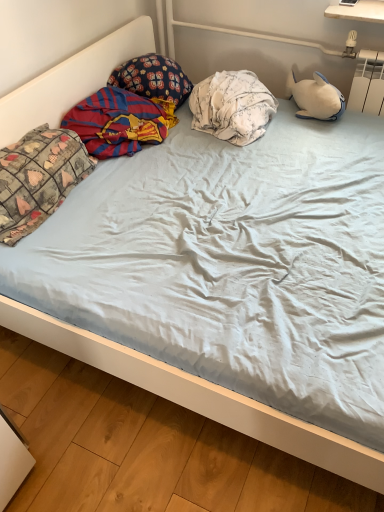
What do you see at coordinates (119, 122) in the screenshot? I see `red and blue striped fabric at left` at bounding box center [119, 122].

Measure the distance between red and blue striped fabric at left and camera.

red and blue striped fabric at left and camera are 1.78 meters apart from each other.

The image size is (384, 512). Describe the element at coordinates (232, 106) in the screenshot. I see `white floral fabric pillow at center, acting as the 3th pillow starting from the left` at that location.

Describe the element at coordinates (38, 178) in the screenshot. I see `patchwork fabric pillow at left, the first pillow from the left` at that location.

Locate an element on the screen. This screenshot has width=384, height=512. red and blue striped fabric at left is located at coordinates (119, 122).

Is white floral fabric pillow at center, placed as the 1th pillow when sorted from right to left, facing away from dark blue floral pillow at upper left, placed as the 2th pillow when sorted from left to right?

Absolutely, white floral fabric pillow at center, placed as the 1th pillow when sorted from right to left, is directed away from dark blue floral pillow at upper left, placed as the 2th pillow when sorted from left to right.

Is white floral fabric pillow at center, placed as the 1th pillow when sorted from right to left, outside of dark blue floral pillow at upper left, which ranks as the 2th pillow in right-to-left order?

white floral fabric pillow at center, placed as the 1th pillow when sorted from right to left, is positioned outside dark blue floral pillow at upper left, which ranks as the 2th pillow in right-to-left order.

Consider the image. Looking at the image, does white floral fabric pillow at center, placed as the 1th pillow when sorted from right to left, seem bigger or smaller compared to dark blue floral pillow at upper left, which ranks as the 2th pillow in right-to-left order?

In the image, white floral fabric pillow at center, placed as the 1th pillow when sorted from right to left, appears to be larger than dark blue floral pillow at upper left, which ranks as the 2th pillow in right-to-left order.

Which of these two, white floral fabric pillow at center, placed as the 1th pillow when sorted from right to left, or dark blue floral pillow at upper left, placed as the 2th pillow when sorted from left to right, stands taller?

Standing taller between the two is dark blue floral pillow at upper left, placed as the 2th pillow when sorted from left to right.

Is red and blue striped fabric at left at the back of dark blue floral pillow at upper left, placed as the 2th pillow when sorted from left to right?

No, dark blue floral pillow at upper left, placed as the 2th pillow when sorted from left to right,'s orientation is not away from red and blue striped fabric at left.

Which is correct: dark blue floral pillow at upper left, which ranks as the 2th pillow in right-to-left order, is inside red and blue striped fabric at left, or outside of it?

dark blue floral pillow at upper left, which ranks as the 2th pillow in right-to-left order, lies outside red and blue striped fabric at left.

Which is nearer, (132,66) or (86,115)?

The point (86,115) is closer.

Is dark blue floral pillow at upper left, which ranks as the 2th pillow in right-to-left order, in front of red and blue striped fabric at left?

No, dark blue floral pillow at upper left, which ranks as the 2th pillow in right-to-left order, is further to the viewer.

Where is `pillow that is the 1st object located behind the patchwork fabric pillow at left, which is counted as the third pillow, starting from the right`? This screenshot has height=512, width=384. pillow that is the 1st object located behind the patchwork fabric pillow at left, which is counted as the third pillow, starting from the right is located at coordinates (232, 106).

Considering the relative positions of patchwork fabric pillow at left, which is counted as the third pillow, starting from the right, and white floral fabric pillow at center, placed as the 1th pillow when sorted from right to left, in the image provided, is patchwork fabric pillow at left, which is counted as the third pillow, starting from the right, behind white floral fabric pillow at center, placed as the 1th pillow when sorted from right to left,?

No, the depth of patchwork fabric pillow at left, which is counted as the third pillow, starting from the right, is less than that of white floral fabric pillow at center, placed as the 1th pillow when sorted from right to left.

Considering the sizes of objects patchwork fabric pillow at left, which is counted as the third pillow, starting from the right, and white floral fabric pillow at center, placed as the 1th pillow when sorted from right to left, in the image provided, who is shorter, patchwork fabric pillow at left, which is counted as the third pillow, starting from the right, or white floral fabric pillow at center, placed as the 1th pillow when sorted from right to left,?

Standing shorter between the two is white floral fabric pillow at center, placed as the 1th pillow when sorted from right to left.

From a real-world perspective, which is physically below, patchwork fabric pillow at left, which is counted as the third pillow, starting from the right, or white floral fabric pillow at center, placed as the 1th pillow when sorted from right to left?

white floral fabric pillow at center, placed as the 1th pillow when sorted from right to left, from a real-world perspective.

From a real-world perspective, is patchwork fabric pillow at left, the first pillow from the left, on dark blue floral pillow at upper left, which ranks as the 2th pillow in right-to-left order?

Actually, patchwork fabric pillow at left, the first pillow from the left, is physically below dark blue floral pillow at upper left, which ranks as the 2th pillow in right-to-left order, in the real world.

Is patchwork fabric pillow at left, the first pillow from the left, directly adjacent to dark blue floral pillow at upper left, placed as the 2th pillow when sorted from left to right?

No, patchwork fabric pillow at left, the first pillow from the left, is not next to dark blue floral pillow at upper left, placed as the 2th pillow when sorted from left to right.

Can you confirm if patchwork fabric pillow at left, the first pillow from the left, is taller than dark blue floral pillow at upper left, placed as the 2th pillow when sorted from left to right?

Yes.

Is point (32, 150) closer or farther from the camera than point (167, 92)?

Point (32, 150).

From a real-world perspective, is red and blue striped fabric at left physically located above or below white floral fabric pillow at center, acting as the 3th pillow starting from the left?

In terms of real-world spatial position, red and blue striped fabric at left is below white floral fabric pillow at center, acting as the 3th pillow starting from the left.

Is red and blue striped fabric at left at the left side of white floral fabric pillow at center, acting as the 3th pillow starting from the left?

Yes.

Where is `the 1st pillow behind the red and blue striped fabric at left`? The height and width of the screenshot is (512, 384). the 1st pillow behind the red and blue striped fabric at left is located at coordinates (232, 106).

Is red and blue striped fabric at left directly adjacent to white floral fabric pillow at center, acting as the 3th pillow starting from the left?

No, red and blue striped fabric at left is not with white floral fabric pillow at center, acting as the 3th pillow starting from the left.

Which is in front, point (155, 61) or point (193, 120)?

The point (193, 120) is closer.

From the image's perspective, is dark blue floral pillow at upper left, placed as the 2th pillow when sorted from left to right, positioned above or below white floral fabric pillow at center, acting as the 3th pillow starting from the left?

dark blue floral pillow at upper left, placed as the 2th pillow when sorted from left to right, is above white floral fabric pillow at center, acting as the 3th pillow starting from the left.

Which is in front, dark blue floral pillow at upper left, placed as the 2th pillow when sorted from left to right, or white floral fabric pillow at center, placed as the 1th pillow when sorted from right to left?

white floral fabric pillow at center, placed as the 1th pillow when sorted from right to left, is in front.

Is white floral fabric pillow at center, acting as the 3th pillow starting from the left, located within dark blue floral pillow at upper left, placed as the 2th pillow when sorted from left to right?

No, white floral fabric pillow at center, acting as the 3th pillow starting from the left, is located outside of dark blue floral pillow at upper left, placed as the 2th pillow when sorted from left to right.

Is red and blue striped fabric at left wider or thinner than patchwork fabric pillow at left, the first pillow from the left?

Considering their sizes, red and blue striped fabric at left looks broader than patchwork fabric pillow at left, the first pillow from the left.

Is red and blue striped fabric at left turned away from patchwork fabric pillow at left, which is counted as the third pillow, starting from the right?

That's not correct — red and blue striped fabric at left is not looking away from patchwork fabric pillow at left, which is counted as the third pillow, starting from the right.

Considering the positions of points (92, 106) and (4, 195), is point (92, 106) farther from camera compared to point (4, 195)?

That is True.

Can you see red and blue striped fabric at left touching patchwork fabric pillow at left, which is counted as the third pillow, starting from the right?

No.

This screenshot has height=512, width=384. What are the coordinates of `pillow on the right of the dark blue floral pillow at upper left, which ranks as the 2th pillow in right-to-left order` in the screenshot? It's located at (232, 106).

From a real-world perspective, count 3rd pillows upward from the red and blue striped fabric at left and point to it. Please provide its 2D coordinates.

[(153, 78)]

When comparing their distances from white floral fabric pillow at center, placed as the 1th pillow when sorted from right to left, does patchwork fabric pillow at left, the first pillow from the left, or dark blue floral pillow at upper left, which ranks as the 2th pillow in right-to-left order, seem further?

patchwork fabric pillow at left, the first pillow from the left, lies further to white floral fabric pillow at center, placed as the 1th pillow when sorted from right to left, than the other object.

From the image, which object appears to be farther from red and blue striped fabric at left, white floral fabric pillow at center, placed as the 1th pillow when sorted from right to left, or patchwork fabric pillow at left, which is counted as the third pillow, starting from the right?

Based on the image, white floral fabric pillow at center, placed as the 1th pillow when sorted from right to left, appears to be further to red and blue striped fabric at left.

When comparing their distances from patchwork fabric pillow at left, which is counted as the third pillow, starting from the right, does white floral fabric pillow at center, acting as the 3th pillow starting from the left, or dark blue floral pillow at upper left, which ranks as the 2th pillow in right-to-left order, seem closer?

dark blue floral pillow at upper left, which ranks as the 2th pillow in right-to-left order, is closer to patchwork fabric pillow at left, which is counted as the third pillow, starting from the right.

Estimate the real-world distances between objects in this image. Which object is further from patchwork fabric pillow at left, which is counted as the third pillow, starting from the right, dark blue floral pillow at upper left, placed as the 2th pillow when sorted from left to right, or red and blue striped fabric at left?

Based on the image, dark blue floral pillow at upper left, placed as the 2th pillow when sorted from left to right, appears to be further to patchwork fabric pillow at left, which is counted as the third pillow, starting from the right.

Looking at the image, which one is located closer to patchwork fabric pillow at left, the first pillow from the left, dark blue floral pillow at upper left, placed as the 2th pillow when sorted from left to right, or white floral fabric pillow at center, placed as the 1th pillow when sorted from right to left?

Among the two, dark blue floral pillow at upper left, placed as the 2th pillow when sorted from left to right, is located nearer to patchwork fabric pillow at left, the first pillow from the left.

Which object lies nearer to the anchor point dark blue floral pillow at upper left, which ranks as the 2th pillow in right-to-left order, patchwork fabric pillow at left, the first pillow from the left, or red and blue striped fabric at left?

red and blue striped fabric at left.

Based on their spatial positions, is patchwork fabric pillow at left, which is counted as the third pillow, starting from the right, or white floral fabric pillow at center, placed as the 1th pillow when sorted from right to left, closer to red and blue striped fabric at left?

The object closer to red and blue striped fabric at left is patchwork fabric pillow at left, which is counted as the third pillow, starting from the right.

Estimate the real-world distances between objects in this image. Which object is further from patchwork fabric pillow at left, the first pillow from the left, red and blue striped fabric at left or dark blue floral pillow at upper left, which ranks as the 2th pillow in right-to-left order?

dark blue floral pillow at upper left, which ranks as the 2th pillow in right-to-left order, is further to patchwork fabric pillow at left, the first pillow from the left.

The height and width of the screenshot is (512, 384). I want to click on material between patchwork fabric pillow at left, which is counted as the third pillow, starting from the right, and dark blue floral pillow at upper left, which ranks as the 2th pillow in right-to-left order, from front to back, so click(119, 122).

Image resolution: width=384 pixels, height=512 pixels. In order to click on pillow between red and blue striped fabric at left and white floral fabric pillow at center, acting as the 3th pillow starting from the left in this screenshot , I will do `click(153, 78)`.

I want to click on pillow between patchwork fabric pillow at left, the first pillow from the left, and white floral fabric pillow at center, acting as the 3th pillow starting from the left, in the horizontal direction, so click(153, 78).

Where is `material between patchwork fabric pillow at left, the first pillow from the left, and white floral fabric pillow at center, placed as the 1th pillow when sorted from right to left`? This screenshot has width=384, height=512. material between patchwork fabric pillow at left, the first pillow from the left, and white floral fabric pillow at center, placed as the 1th pillow when sorted from right to left is located at coordinates (119, 122).